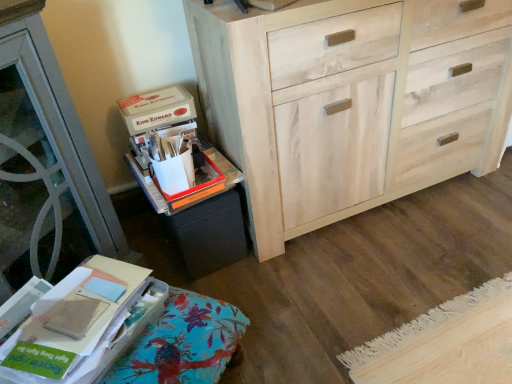
Question: Considering the relative positions of matte cardboard box at upper left and natural wood cabinet at center in the image provided, is matte cardboard box at upper left to the left of natural wood cabinet at center from the viewer's perspective?

Choices:
 (A) no
 (B) yes

Answer: (B)

Question: Is matte cardboard box at upper left directly adjacent to natural wood cabinet at center?

Choices:
 (A) no
 (B) yes

Answer: (A)

Question: Does matte cardboard box at upper left have a larger size compared to natural wood cabinet at center?

Choices:
 (A) no
 (B) yes

Answer: (A)

Question: Does matte cardboard box at upper left appear on the right side of natural wood cabinet at center?

Choices:
 (A) yes
 (B) no

Answer: (B)

Question: Is matte cardboard box at upper left completely or partially outside of natural wood cabinet at center?

Choices:
 (A) yes
 (B) no

Answer: (A)

Question: From a real-world perspective, is matte cardboard box at upper left physically located above or below natural wood cabinet at center?

Choices:
 (A) below
 (B) above

Answer: (B)

Question: Looking at the image, does matte cardboard box at upper left seem bigger or smaller compared to natural wood cabinet at center?

Choices:
 (A) small
 (B) big

Answer: (A)

Question: In the image, is matte cardboard box at upper left on the left side or the right side of natural wood cabinet at center?

Choices:
 (A) right
 (B) left

Answer: (B)

Question: Is matte cardboard box at upper left wider or thinner than natural wood cabinet at center?

Choices:
 (A) wide
 (B) thin

Answer: (B)

Question: From a real-world perspective, relative to matte cardboard box at upper left, is matte cardboard book at lower left vertically above or below?

Choices:
 (A) above
 (B) below

Answer: (B)

Question: Is matte cardboard book at lower left in front of or behind matte cardboard box at upper left in the image?

Choices:
 (A) behind
 (B) front

Answer: (B)

Question: Considering the relative positions of matte cardboard book at lower left and matte cardboard box at upper left in the image provided, is matte cardboard book at lower left to the left or to the right of matte cardboard box at upper left?

Choices:
 (A) right
 (B) left

Answer: (B)

Question: In terms of size, does matte cardboard book at lower left appear bigger or smaller than matte cardboard box at upper left?

Choices:
 (A) small
 (B) big

Answer: (B)

Question: In the image, is black matte storage bin at lower left positioned in front of or behind matte cardboard book at lower left?

Choices:
 (A) front
 (B) behind

Answer: (B)

Question: Choose the correct answer: Is black matte storage bin at lower left inside matte cardboard book at lower left or outside it?

Choices:
 (A) inside
 (B) outside

Answer: (B)